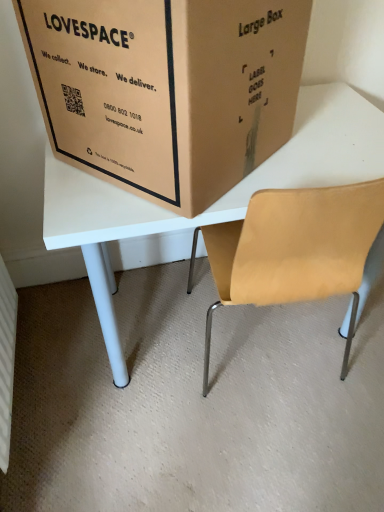
Question: From their relative heights in the image, would you say brown cardboard box at upper center is taller or shorter than matte white table at center?

Choices:
 (A) tall
 (B) short

Answer: (B)

Question: From the image's perspective, is brown cardboard box at upper center located above or below matte white table at center?

Choices:
 (A) above
 (B) below

Answer: (A)

Question: Visually, is brown cardboard box at upper center positioned to the left or to the right of matte white table at center?

Choices:
 (A) right
 (B) left

Answer: (B)

Question: Considering the positions of matte white table at center and brown cardboard box at upper center in the image, is matte white table at center bigger or smaller than brown cardboard box at upper center?

Choices:
 (A) small
 (B) big

Answer: (B)

Question: From a real-world perspective, relative to brown cardboard box at upper center, is matte white table at center vertically above or below?

Choices:
 (A) below
 (B) above

Answer: (A)

Question: From the image's perspective, is matte white table at center above or below brown cardboard box at upper center?

Choices:
 (A) above
 (B) below

Answer: (B)

Question: Is matte white table at center wider or thinner than brown cardboard box at upper center?

Choices:
 (A) thin
 (B) wide

Answer: (B)